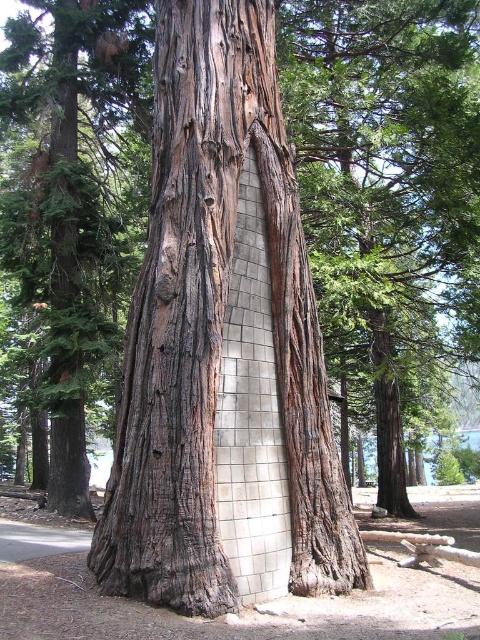
Question: From the image, what is the correct spatial relationship of smooth bark tree trunk at center in relation to rough bark tree at center?

Choices:
 (A) below
 (B) above

Answer: (A)

Question: Does smooth bark tree trunk at center appear on the left side of rough bark tree at center?

Choices:
 (A) no
 (B) yes

Answer: (A)

Question: Does smooth bark tree trunk at center appear on the right side of rough bark tree at center?

Choices:
 (A) yes
 (B) no

Answer: (A)

Question: Which of the following is the closest to the observer?

Choices:
 (A) smooth bark tree trunk at center
 (B) rough bark tree at center

Answer: (A)